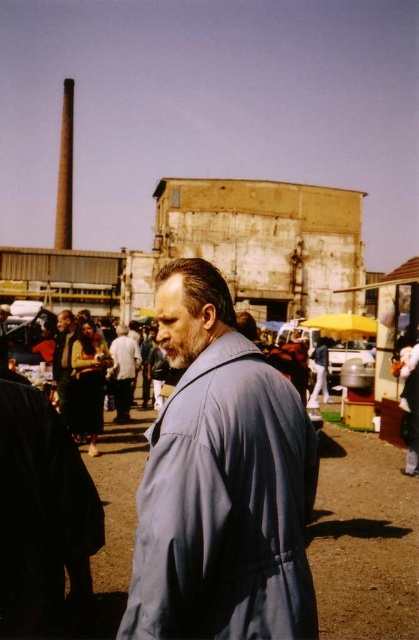
Is black matte robe at center smaller than matte black jacket at lower left?

Yes.

Who is more forward, (41, 540) or (62, 320)?

Positioned in front is point (41, 540).

What do you see at coordinates (43, 509) in the screenshot? The width and height of the screenshot is (419, 640). I see `black matte robe at center` at bounding box center [43, 509].

Identify the location of black matte robe at center. (43, 509).

Can you confirm if blue fabric coat at center is positioned to the right of matte black jacket at lower left?

Indeed, blue fabric coat at center is positioned on the right side of matte black jacket at lower left.

Does point (162, 310) come closer to viewer compared to point (75, 330)?

Yes, it is.

This screenshot has height=640, width=419. What are the coordinates of `blue fabric coat at center` in the screenshot? It's located at (220, 481).

Does blue fabric coat at center appear under light brown leather jacket at center?

Indeed, blue fabric coat at center is positioned under light brown leather jacket at center.

Measure the distance from blue fabric coat at center to light brown leather jacket at center.

109.61 feet

Image resolution: width=419 pixels, height=640 pixels. I want to click on blue fabric coat at center, so click(220, 481).

Image resolution: width=419 pixels, height=640 pixels. In order to click on blue fabric coat at center in this screenshot , I will do `click(220, 481)`.